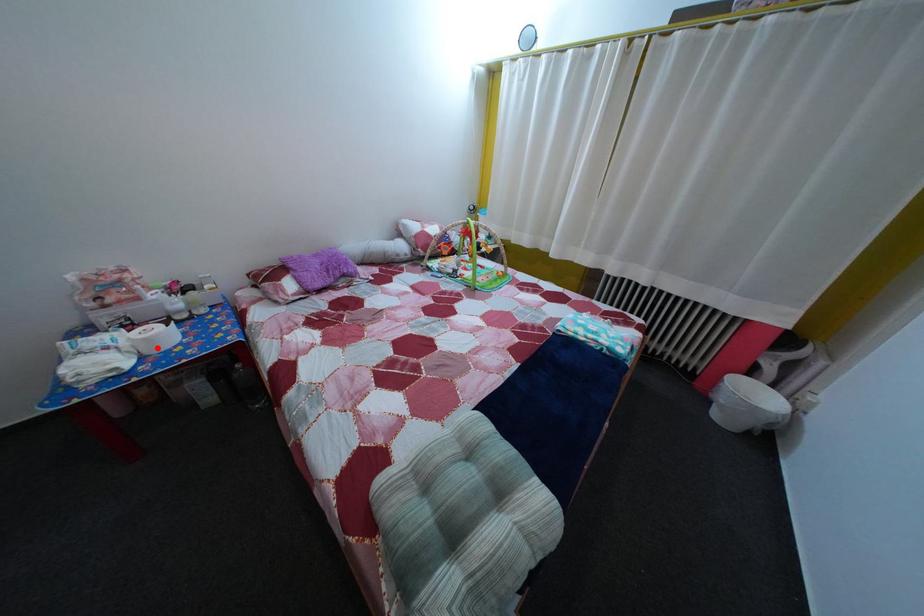
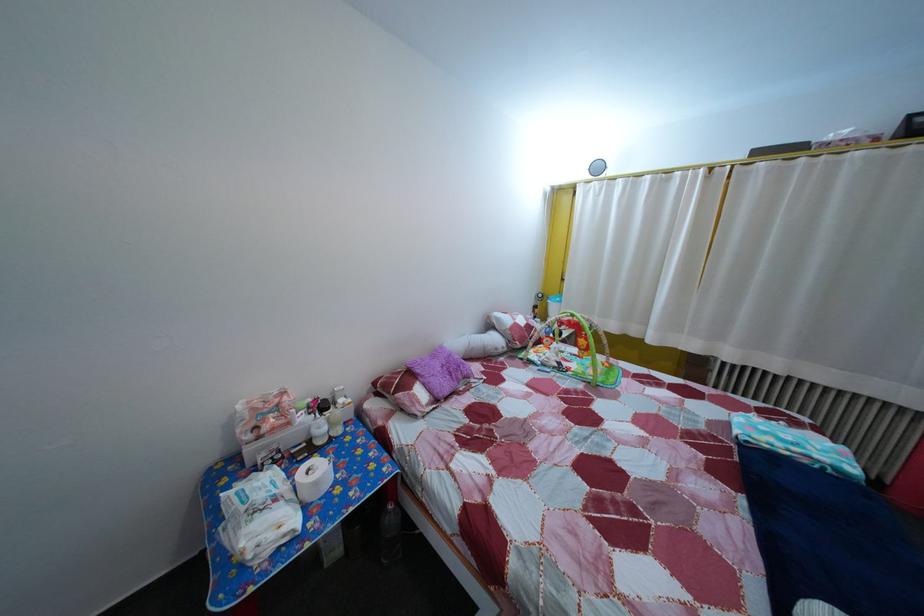
Where in the second image is the point corresponding to the highlighted location from the first image?

(325, 491)